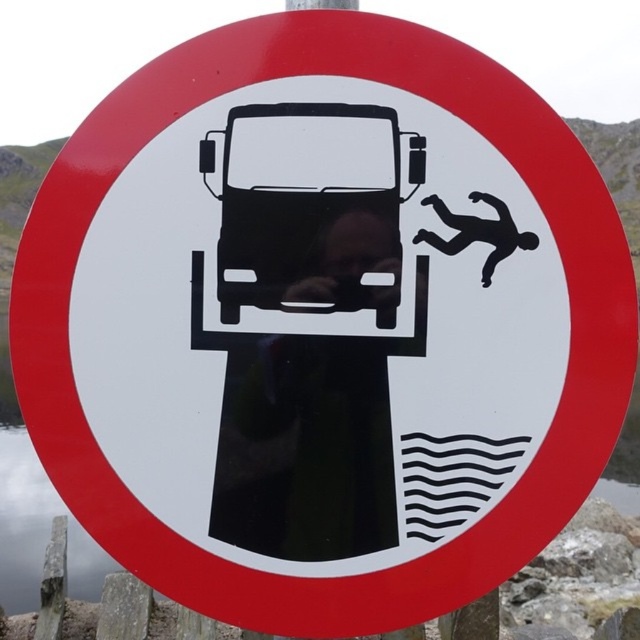
You are standing in front of a circular traffic sign with a red border and white background. The sign has a black silhouette of a vehicle and a figure falling into water. There is a point at coordinates point (372, 467). If you want to touch this point on the sign with a stick that is 4 feet long, will the stick be long enough?

The point at point (372, 467) is 5.05 feet away from you. Since the stick is only 4 feet long, it is not long enough to reach the point on the sign.

Based on the photo, based on the scene description and the position of the black glossy car at center, where would you expect to find this traffic sign in relation to the car?

The traffic sign is located at the same position as the black glossy car at center, specifically at coordinates point (307, 449).